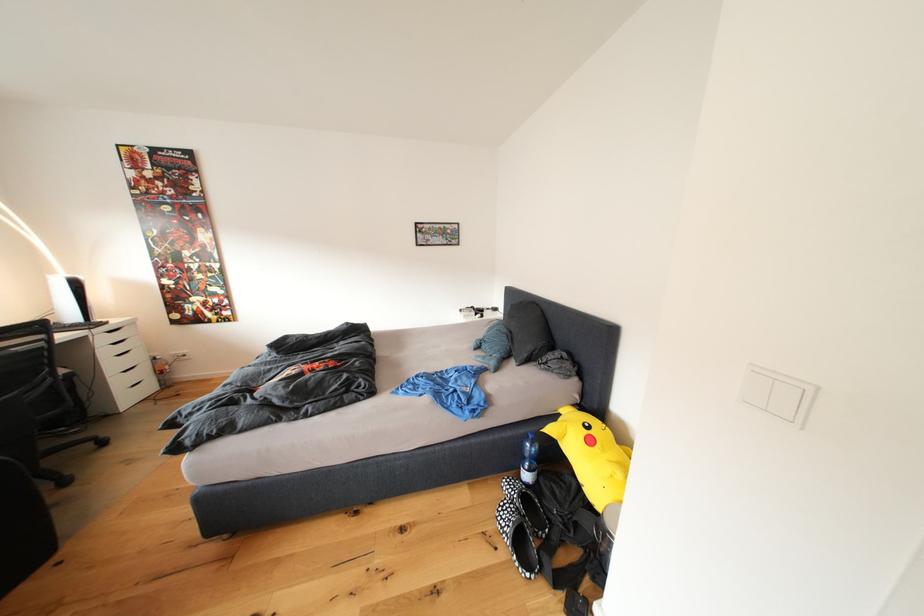
Image resolution: width=924 pixels, height=616 pixels. I want to click on black chair armrest, so click(x=65, y=373).